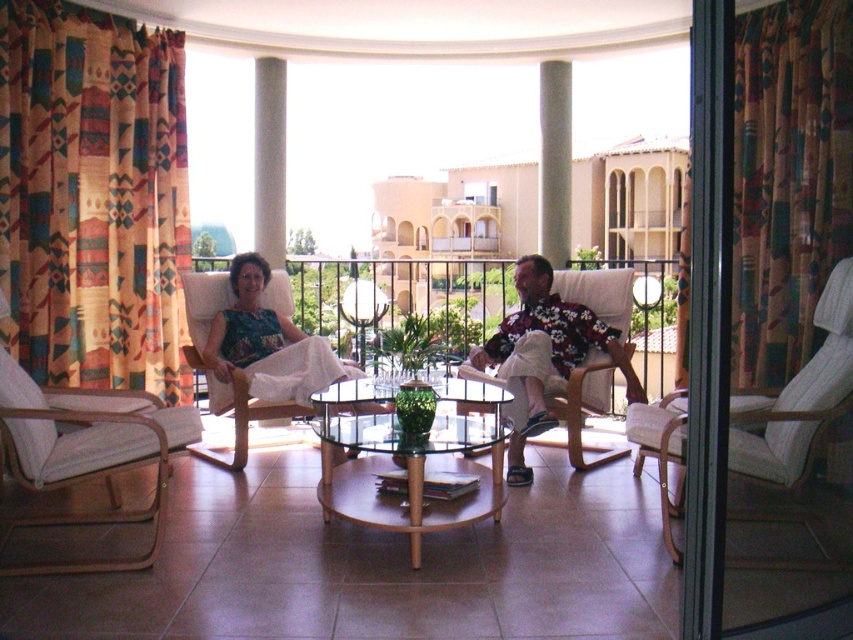
You are standing at the entrance of the balcony and want to reach a specific point marked as point (700,486). Is this point within your immediate reach without moving further into the balcony area?

The distance of point (700,486) from viewer is 2.10 meters, so the point is 2.10 meters away. Since you are at the entrance, you would need to move forward into the balcony to reach it as it is beyond your immediate reach.

You are sitting on the floral fabric armchair at center and want to look at the view outside through the multicolored fabric curtain at right. Can you see the view clearly through the curtain?

The multicolored fabric curtain at right is located above the floral fabric armchair at center, so you can see the view clearly through the curtain since it is positioned above your head and not blocking your line of sight.

Looking at this image, you are organizing a small gathering and need to place a large potted plant between the matte floral shirt at center and the white fabric armchair at right. Can the space between them accommodate the plant?

The matte floral shirt at center is bigger than the white fabric armchair at right. However, the description does not provide information about the distance between them. Therefore, it is impossible to determine if the space can accommodate the plant based on the given details.